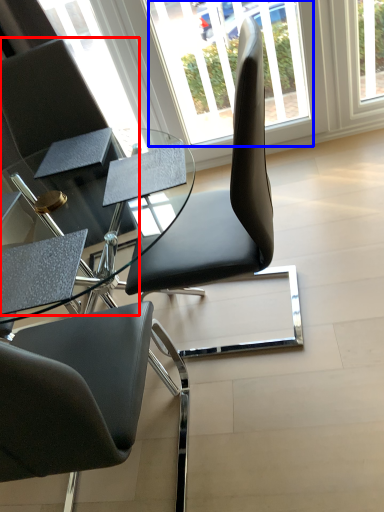
Question: Among these objects, which one is farthest to the camera, chair (highlighted by a red box) or window (highlighted by a blue box)?

Choices:
 (A) chair
 (B) window

Answer: (B)